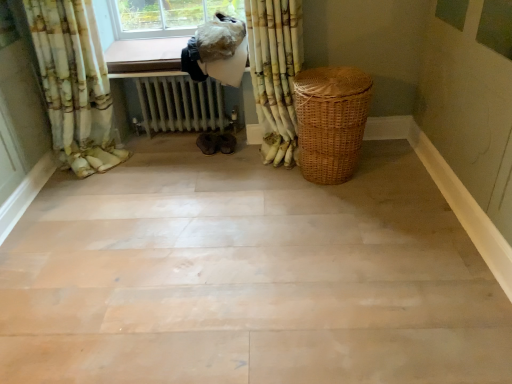
Locate an element on the screen. The width and height of the screenshot is (512, 384). free space above wooden floor at center (from a real-world perspective) is located at coordinates (175, 226).